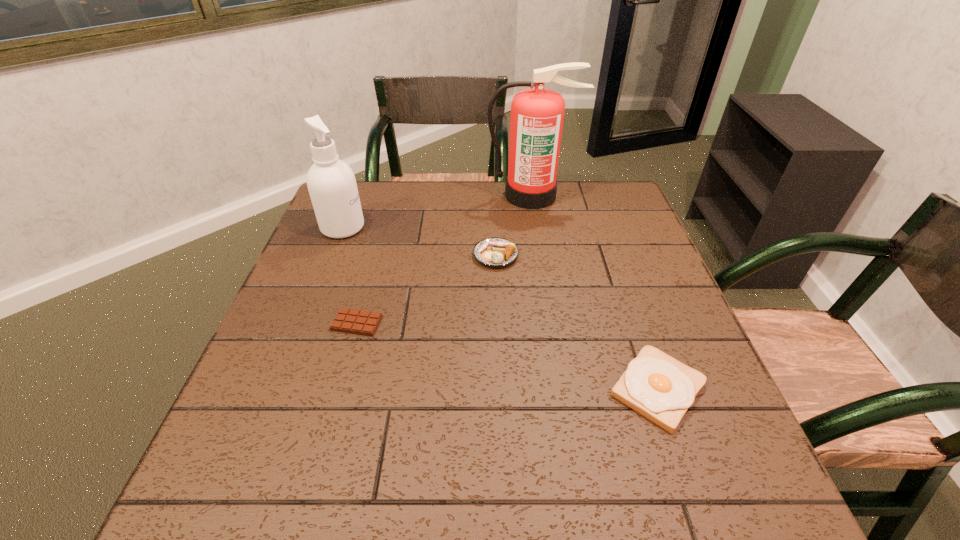
Where is `the farthest object`? Image resolution: width=960 pixels, height=540 pixels. the farthest object is located at coordinates (537, 114).

Where is `the tallest object`? the tallest object is located at coordinates pos(537,114).

Where is `the leftmost object`? The image size is (960, 540). the leftmost object is located at coordinates (331, 183).

Identify the location of the second tallest object. This screenshot has height=540, width=960. (331, 183).

Identify the location of the third tallest object. (496, 252).

The image size is (960, 540). Find the location of `the third farthest object`. the third farthest object is located at coordinates (496, 252).

Find the location of `the nearest object`. the nearest object is located at coordinates (659, 387).

The height and width of the screenshot is (540, 960). What are the coordinates of `the fourth tallest object` in the screenshot? It's located at click(x=659, y=387).

Locate an element on the screen. The height and width of the screenshot is (540, 960). the second object from left to right is located at coordinates (361, 322).

You are a GUI agent. You are given a task and a screenshot of the screen. Output one action in this format:
    pyautogui.click(x=<x>, y=<y>)
    Task: Click on the second nearest object
    
    Given the screenshot: What is the action you would take?
    [x=361, y=322]